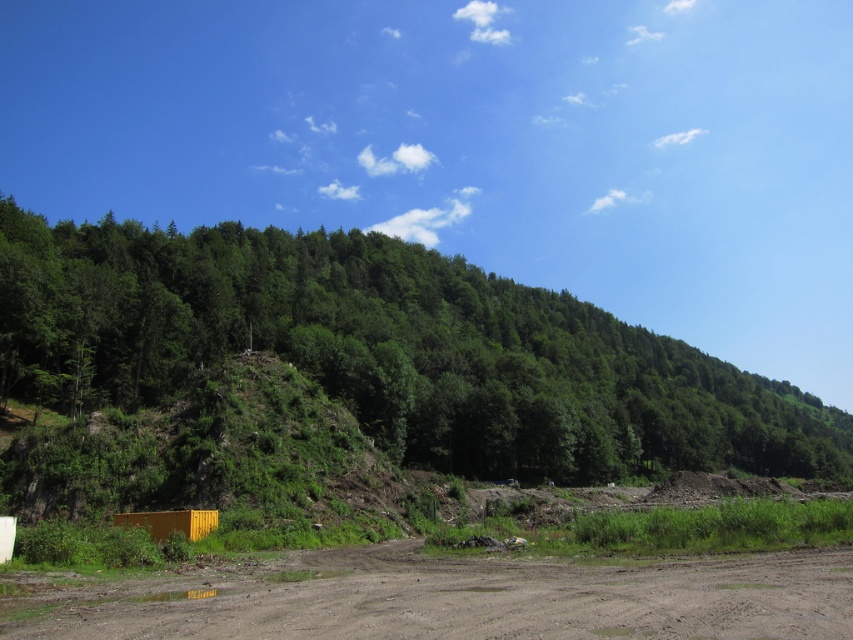
In the scene shown: Is the position of green leafy tree at center more distant than that of brown muddy dirt field at lower center?

Yes, it is.

Based on the photo, which of these two, green leafy tree at center or brown muddy dirt field at lower center, stands shorter?

With less height is brown muddy dirt field at lower center.

Where is `green leafy tree at center`? green leafy tree at center is located at coordinates (390, 349).